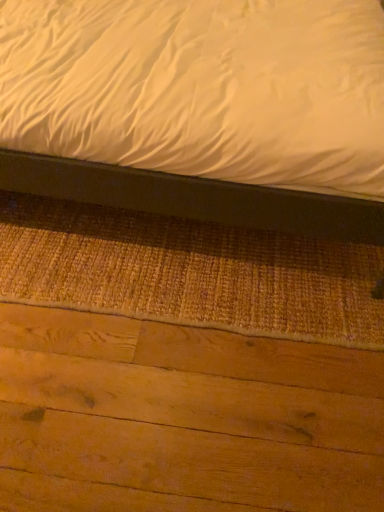
Describe the element at coordinates (194, 197) in the screenshot. I see `matte black bed at upper center` at that location.

Find the location of a particular element. The width and height of the screenshot is (384, 512). matte black bed at upper center is located at coordinates (194, 197).

Locate an element on the screen. Image resolution: width=384 pixels, height=512 pixels. natural wood plywood at bottom is located at coordinates coord(183,418).

Describe the element at coordinates (183, 418) in the screenshot. Image resolution: width=384 pixels, height=512 pixels. I see `natural wood plywood at bottom` at that location.

Find the location of a particular element. Image resolution: width=384 pixels, height=512 pixels. matte black bed at upper center is located at coordinates [194, 197].

Is natural wood plywood at bottom at the right side of matte black bed at upper center?

Correct, you'll find natural wood plywood at bottom to the right of matte black bed at upper center.

Which object is further away from the camera taking this photo, natural wood plywood at bottom or matte black bed at upper center?

natural wood plywood at bottom.

Which is less distant, (281, 509) or (159, 187)?

The point (281, 509) is closer.

From the image's perspective, is natural wood plywood at bottom below matte black bed at upper center?

Yes, from the image's perspective, natural wood plywood at bottom is below matte black bed at upper center.

From a real-world perspective, which is physically below, natural wood plywood at bottom or matte black bed at upper center?

natural wood plywood at bottom, from a real-world perspective.

Which object is thinner, natural wood plywood at bottom or matte black bed at upper center?

natural wood plywood at bottom is thinner.

Between natural wood plywood at bottom and matte black bed at upper center, which one has less height?

With less height is natural wood plywood at bottom.

Looking at the image, does natural wood plywood at bottom seem bigger or smaller compared to matte black bed at upper center?

natural wood plywood at bottom is smaller than matte black bed at upper center.

Is natural wood plywood at bottom not within matte black bed at upper center?

That's correct, natural wood plywood at bottom is outside of matte black bed at upper center.

Is there a large distance between natural wood plywood at bottom and matte black bed at upper center?

No.

Looking at this image, could you tell me if natural wood plywood at bottom is facing matte black bed at upper center?

No, natural wood plywood at bottom is not aimed at matte black bed at upper center.

Identify the location of plywood located underneath the matte black bed at upper center (from a real-world perspective). (183, 418).

In the scene shown: Which object is positioned more to the left, matte black bed at upper center or natural wood plywood at bottom?

matte black bed at upper center is more to the left.

Does matte black bed at upper center come in front of natural wood plywood at bottom?

Yes, it is.

Which is less distant, (272, 188) or (349, 440)?

Point (272, 188) is farther from the camera than point (349, 440).

In the scene shown: From the image's perspective, is matte black bed at upper center located above or below natural wood plywood at bottom?

matte black bed at upper center is situated higher than natural wood plywood at bottom in the image.

From a real-world perspective, is matte black bed at upper center over natural wood plywood at bottom?

Yes, from a real-world perspective, matte black bed at upper center is on top of natural wood plywood at bottom.

In terms of width, does matte black bed at upper center look wider or thinner when compared to natural wood plywood at bottom?

Clearly, matte black bed at upper center has more width compared to natural wood plywood at bottom.

Can you confirm if matte black bed at upper center is shorter than natural wood plywood at bottom?

No.

Consider the image. Considering the sizes of objects matte black bed at upper center and natural wood plywood at bottom in the image provided, who is bigger, matte black bed at upper center or natural wood plywood at bottom?

Result: Bigger between the two is matte black bed at upper center.

In the scene shown: Can natural wood plywood at bottom be found inside matte black bed at upper center?

No, natural wood plywood at bottom is not a part of matte black bed at upper center.

Is matte black bed at upper center touching natural wood plywood at bottom?

No, matte black bed at upper center is not beside natural wood plywood at bottom.

Is matte black bed at upper center looking in the opposite direction of natural wood plywood at bottom?

matte black bed at upper center does not have its back to natural wood plywood at bottom.

Based on the photo, how many degrees apart are the facing directions of matte black bed at upper center and natural wood plywood at bottom?

178 degrees.

This screenshot has width=384, height=512. Find the location of `bed lying in front of the natural wood plywood at bottom`. bed lying in front of the natural wood plywood at bottom is located at coordinates (194, 197).

The width and height of the screenshot is (384, 512). Identify the location of bed above the natural wood plywood at bottom (from a real-world perspective). (194, 197).

Where is `plywood located below the matte black bed at upper center (from the image's perspective)`? The image size is (384, 512). plywood located below the matte black bed at upper center (from the image's perspective) is located at coordinates [x=183, y=418].